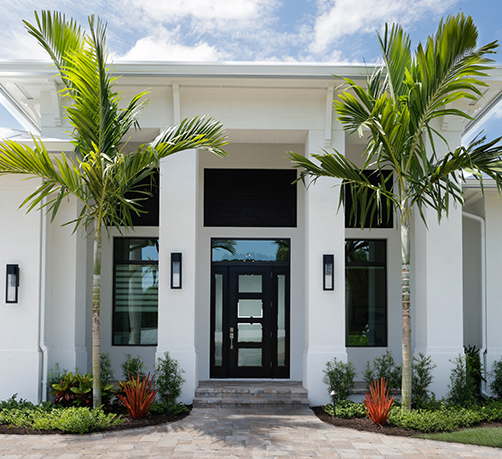
I want to click on door, so click(x=233, y=306).